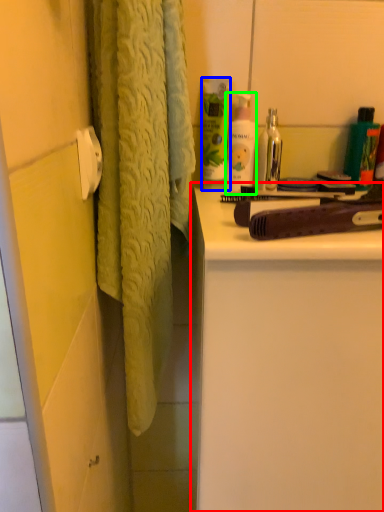
Question: Considering the real-world distances, which object is farthest from bathroom cabinet (highlighted by a red box)? cleaning product (highlighted by a blue box) or toiletry (highlighted by a green box)?

Choices:
 (A) cleaning product
 (B) toiletry

Answer: (A)